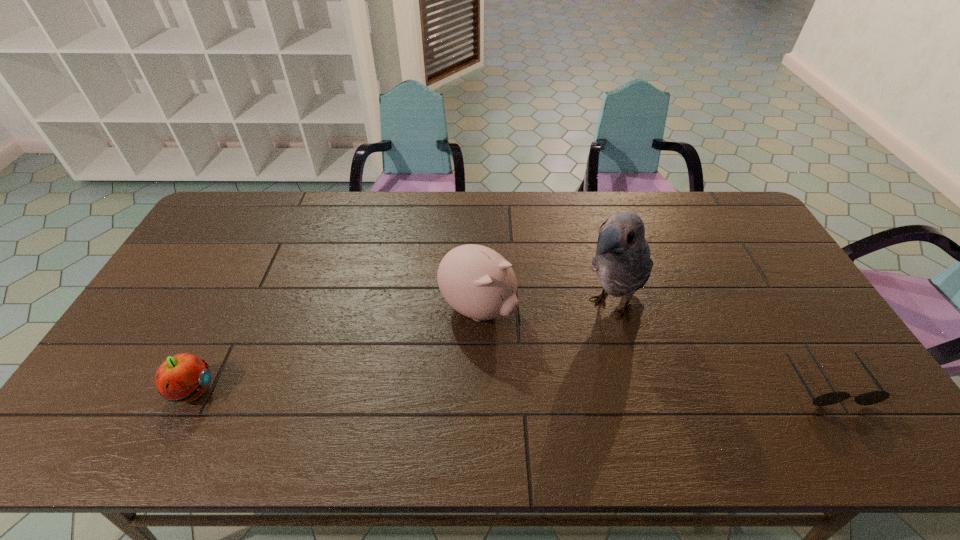
The height and width of the screenshot is (540, 960). I want to click on vacant space at the near edge, so click(428, 398).

This screenshot has height=540, width=960. In order to click on free space at the left edge in this screenshot , I will do [x=207, y=270].

You are a GUI agent. You are given a task and a screenshot of the screen. Output one action in this format:
    pyautogui.click(x=<x>, y=<y>)
    Task: Click on the vacant region at the right edge of the desktop
    
    Given the screenshot: What is the action you would take?
    pyautogui.click(x=828, y=372)

You are a GUI agent. You are given a task and a screenshot of the screen. Output one action in this format:
    pyautogui.click(x=<x>, y=<y>)
    Task: Click on the free space at the far right corner
    
    Given the screenshot: What is the action you would take?
    pyautogui.click(x=728, y=223)

At what (x,y) coordinates should I click in order to perform the action: click on free space at the near right corner. Please return your answer as a coordinate pair (x, y). The image size is (960, 540). Looking at the image, I should click on (847, 379).

The image size is (960, 540). I want to click on empty space between the sunglasses and the third object from right to left, so click(x=653, y=345).

Locate an element on the screen. The image size is (960, 540). vacant area between the second object from right to left and the second tallest object is located at coordinates (544, 307).

At what (x,y) coordinates should I click in order to perform the action: click on empty location between the rightmost object and the third object from left to right. Please return your answer as a coordinate pair (x, y). The width and height of the screenshot is (960, 540). Looking at the image, I should click on (719, 345).

You are a GUI agent. You are given a task and a screenshot of the screen. Output one action in this format:
    pyautogui.click(x=<x>, y=<y>)
    Task: Click on the vacant point located between the third shortest object and the third tallest object
    This screenshot has height=540, width=960.
    Given the screenshot: What is the action you would take?
    pyautogui.click(x=335, y=349)

The image size is (960, 540). Find the location of `unoccupied area between the shortest object and the leftmost object`. unoccupied area between the shortest object and the leftmost object is located at coordinates (510, 387).